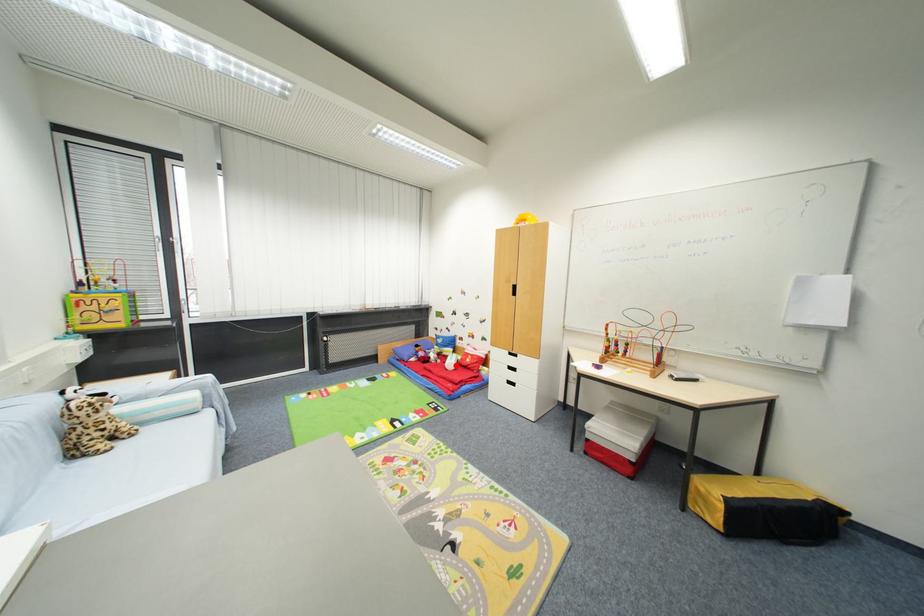
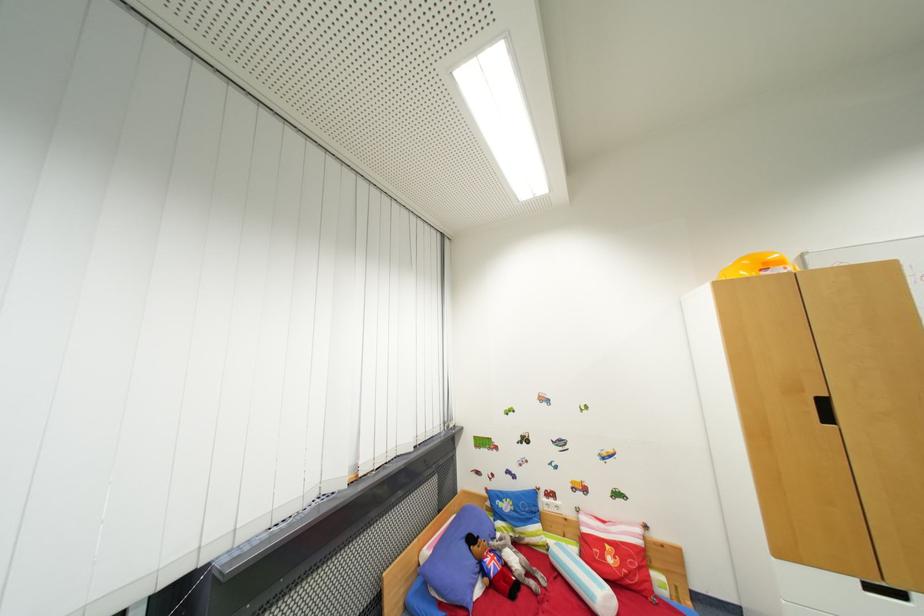
Question: I am providing you with two images of the same scene from different viewpoints. In image1, a red point is highlighted. Considering the same 3D point in image2, which of the following is correct?

Choices:
 (A) It is closer
 (B) It is farther

Answer: (B)